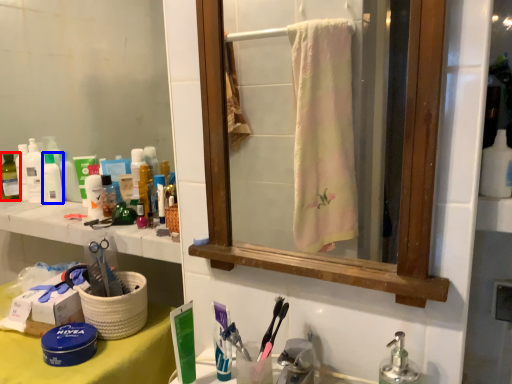
Question: Which object is further to the camera taking this photo, toiletry (highlighted by a red box) or toiletry (highlighted by a blue box)?

Choices:
 (A) toiletry
 (B) toiletry

Answer: (A)